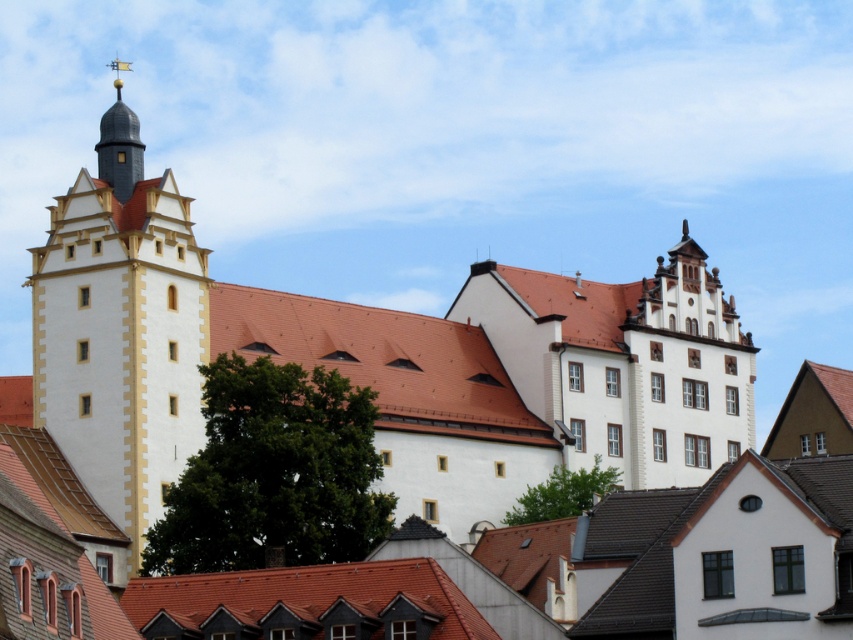
How distant is matte white tower at left from shiny gold spire at upper left?

matte white tower at left and shiny gold spire at upper left are 6.42 meters apart.

Between matte white tower at left and shiny gold spire at upper left, which one has less height?

With less height is shiny gold spire at upper left.

Who is more distant from viewer, [196,250] or [103,170]?

The point [103,170] is behind.

Where is `matte white tower at left`? The width and height of the screenshot is (853, 640). matte white tower at left is located at coordinates (120, 330).

Who is higher up, white matte building at center or matte white tower at left?

matte white tower at left

Does white matte building at center appear on the right side of matte white tower at left?

Indeed, white matte building at center is positioned on the right side of matte white tower at left.

The image size is (853, 640). Identify the location of white matte building at center. (379, 365).

The width and height of the screenshot is (853, 640). In order to click on white matte building at center in this screenshot , I will do [379, 365].

Is white matte building at center shorter than shiny gold spire at upper left?

Yes, white matte building at center is shorter than shiny gold spire at upper left.

This screenshot has height=640, width=853. What do you see at coordinates (379, 365) in the screenshot?
I see `white matte building at center` at bounding box center [379, 365].

Measure the distance between point (167, 378) and camera.

A distance of 312.04 feet exists between point (167, 378) and camera.

This screenshot has height=640, width=853. Find the location of `white matte building at center`. white matte building at center is located at coordinates (379, 365).